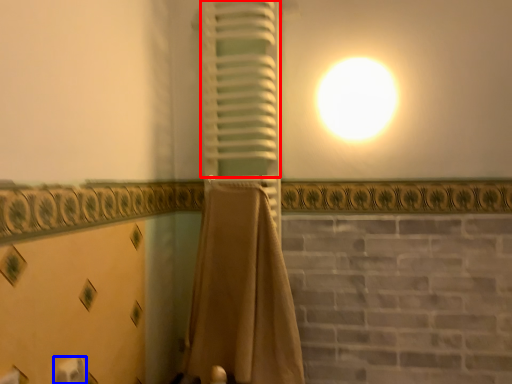
Question: Which object appears farthest to the camera in this image, curtain (highlighted by a red box) or toilet paper (highlighted by a blue box)?

Choices:
 (A) curtain
 (B) toilet paper

Answer: (A)